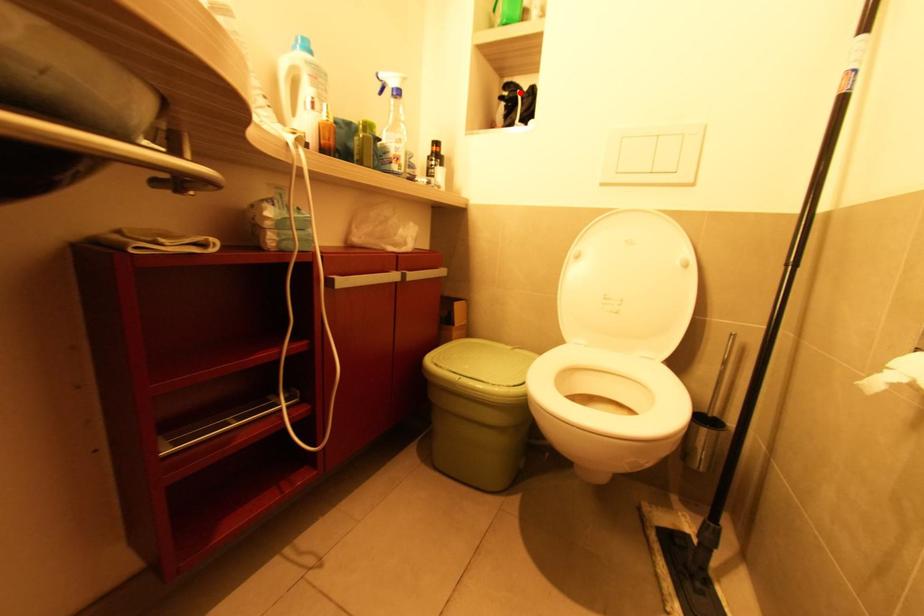
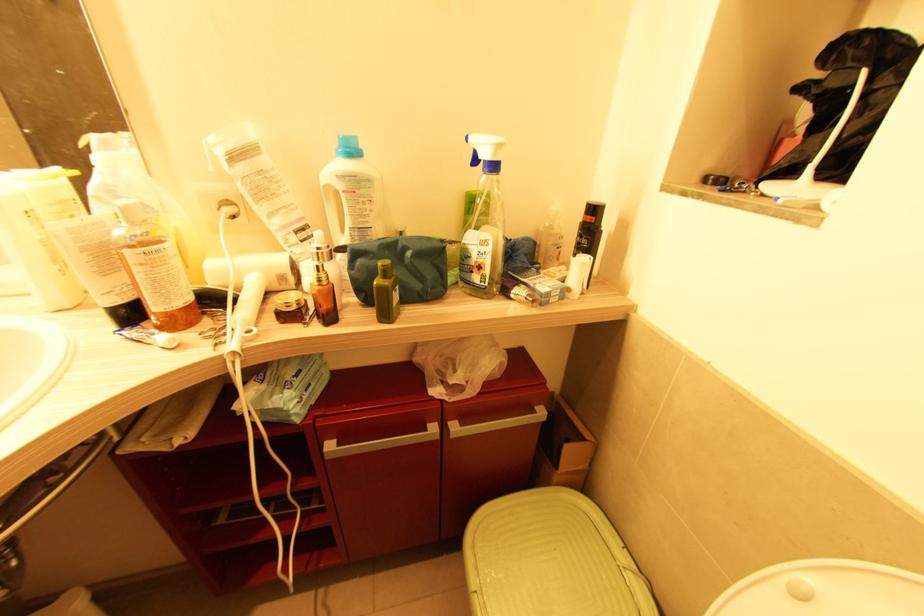
Question: A red point is marked in image1. In image2, is the corresponding 3D point closer to the camera or farther? Reply with the corresponding letter.

Choices:
 (A) The corresponding 3D point is closer.
 (B) The corresponding 3D point is farther.

Answer: (B)